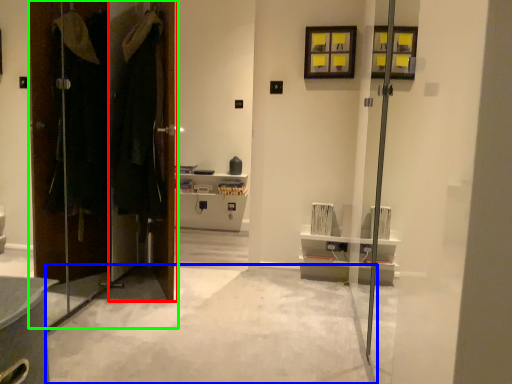
Question: Based on their relative distances, which object is nearer to door (highlighted by a red box)? Choose from concrete (highlighted by a blue box) and door (highlighted by a green box).

Choices:
 (A) concrete
 (B) door

Answer: (B)